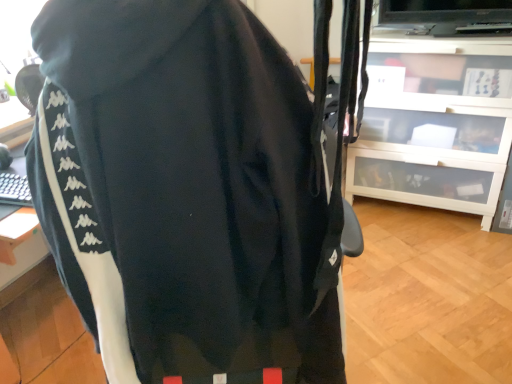
This screenshot has height=384, width=512. What do you see at coordinates (184, 192) in the screenshot?
I see `black fabric wetsuit at center` at bounding box center [184, 192].

Locate an element on the screen. Image resolution: width=512 pixels, height=384 pixels. black fabric wetsuit at center is located at coordinates (184, 192).

This screenshot has width=512, height=384. Identify the location of black fabric wetsuit at center. (184, 192).